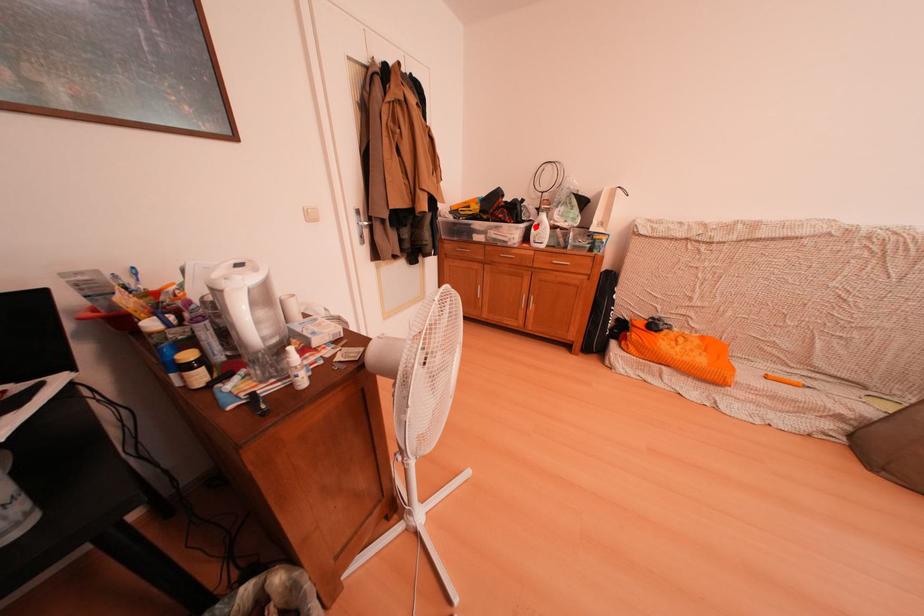
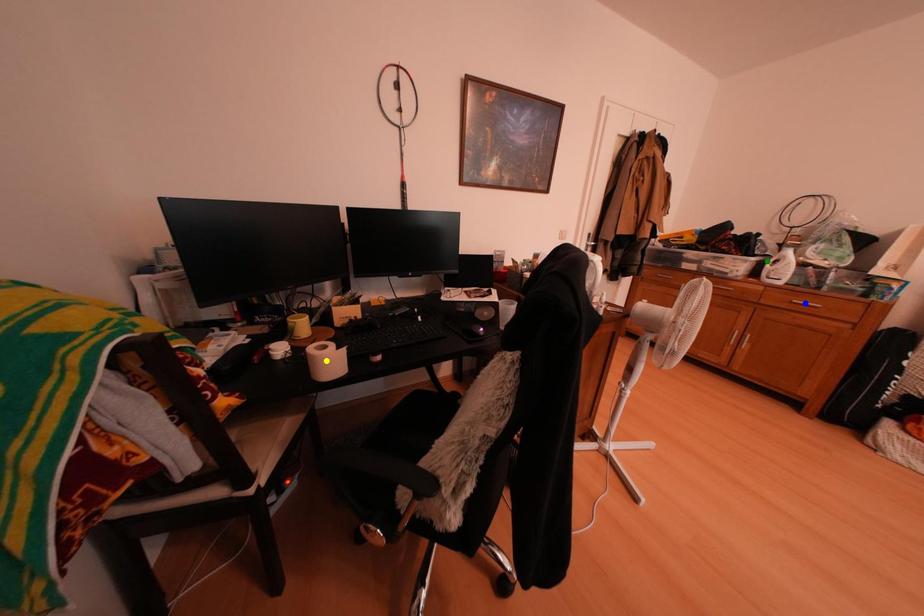
Question: I am providing you with two images of the same scene from different viewpoints. A red point is marked on the first image. You are given multiple points on the second image. Which point in image 2 represents the same 3d spot as the red point in image 1?

Choices:
 (A) green point
 (B) yellow point
 (C) blue point

Answer: (A)